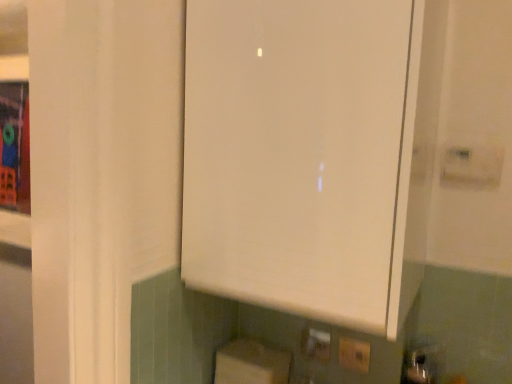
Question: From the image's perspective, is white plastic electric outlet at lower center, marked as the 1th electric outlet in a front-to-back arrangement, beneath white matte cabinet at center?

Choices:
 (A) no
 (B) yes

Answer: (B)

Question: Is white plastic electric outlet at lower center, which is the 2th electric outlet in left-to-right order, turned away from white matte cabinet at center?

Choices:
 (A) no
 (B) yes

Answer: (A)

Question: Is white plastic electric outlet at lower center, which is the 2th electric outlet in left-to-right order, behind white matte cabinet at center?

Choices:
 (A) yes
 (B) no

Answer: (A)

Question: Is the depth of white plastic electric outlet at lower center, which is counted as the 1th electric outlet, starting from the right, less than that of white matte cabinet at center?

Choices:
 (A) yes
 (B) no

Answer: (B)

Question: Does white plastic electric outlet at lower center, which is counted as the 1th electric outlet, starting from the right, have a lesser width compared to white matte cabinet at center?

Choices:
 (A) no
 (B) yes

Answer: (B)

Question: Does white plastic electric outlet at lower center, which appears as the 2th electric outlet when viewed from the back, have a greater width compared to white matte cabinet at center?

Choices:
 (A) yes
 (B) no

Answer: (B)

Question: Considering the relative sizes of white plastic electric outlet at lower center, which appears as the 2th electric outlet when viewed from the back, and yellow plastic electric outlet at lower center, which is the 2th electric outlet from right to left, in the image provided, is white plastic electric outlet at lower center, which appears as the 2th electric outlet when viewed from the back, taller than yellow plastic electric outlet at lower center, which is the 2th electric outlet from right to left,?

Choices:
 (A) no
 (B) yes

Answer: (B)

Question: From the image's perspective, does white plastic electric outlet at lower center, which appears as the 2th electric outlet when viewed from the back, appear higher than yellow plastic electric outlet at lower center, placed as the first electric outlet when sorted from left to right?

Choices:
 (A) no
 (B) yes

Answer: (A)

Question: Does white plastic electric outlet at lower center, which appears as the 2th electric outlet when viewed from the back, have a larger size compared to yellow plastic electric outlet at lower center, which appears as the first electric outlet when viewed from the back?

Choices:
 (A) no
 (B) yes

Answer: (A)

Question: Is white plastic electric outlet at lower center, which is counted as the 1th electric outlet, starting from the right, directly adjacent to yellow plastic electric outlet at lower center, which is the 2th electric outlet from right to left?

Choices:
 (A) yes
 (B) no

Answer: (A)

Question: Does white plastic electric outlet at lower center, which appears as the 2th electric outlet when viewed from the back, have a greater width compared to yellow plastic electric outlet at lower center, which appears as the first electric outlet when viewed from the back?

Choices:
 (A) yes
 (B) no

Answer: (B)

Question: From a real-world perspective, is white plastic electric outlet at lower center, which is counted as the 1th electric outlet, starting from the right, physically below yellow plastic electric outlet at lower center, placed as the first electric outlet when sorted from left to right?

Choices:
 (A) no
 (B) yes

Answer: (A)

Question: Considering the relative positions of white matte cabinet at center and white cardboard box at lower center in the image provided, is white matte cabinet at center in front of white cardboard box at lower center?

Choices:
 (A) yes
 (B) no

Answer: (A)